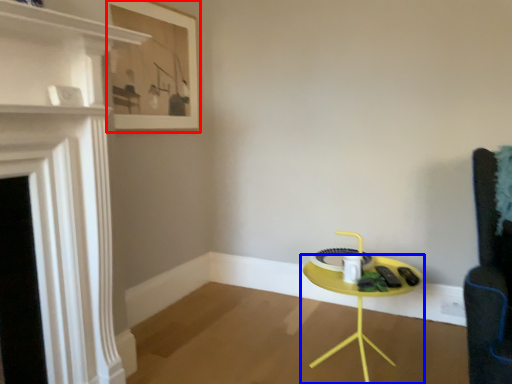
Question: Which object is further to the camera taking this photo, picture frame (highlighted by a red box) or table (highlighted by a blue box)?

Choices:
 (A) picture frame
 (B) table

Answer: (A)